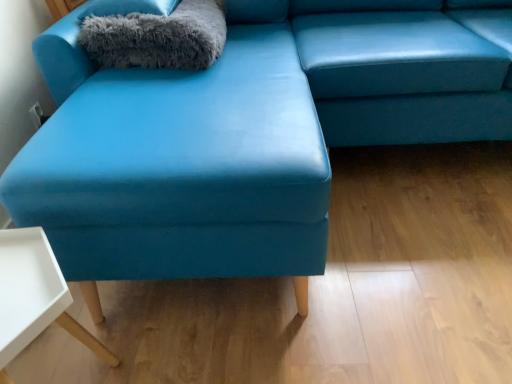
Question: From a real-world perspective, is gray fluffy pillow at upper left under white matte table at lower left?

Choices:
 (A) no
 (B) yes

Answer: (A)

Question: Is gray fluffy pillow at upper left facing towards white matte table at lower left?

Choices:
 (A) no
 (B) yes

Answer: (A)

Question: Is gray fluffy pillow at upper left wider than white matte table at lower left?

Choices:
 (A) yes
 (B) no

Answer: (A)

Question: From the image's perspective, is gray fluffy pillow at upper left located above white matte table at lower left?

Choices:
 (A) yes
 (B) no

Answer: (A)

Question: Is gray fluffy pillow at upper left positioned behind white matte table at lower left?

Choices:
 (A) no
 (B) yes

Answer: (B)

Question: Is matte blue cushion at center in front of or behind gray fluffy blanket at upper left in the image?

Choices:
 (A) behind
 (B) front

Answer: (B)

Question: Considering the positions of matte blue cushion at center and gray fluffy blanket at upper left in the image, is matte blue cushion at center bigger or smaller than gray fluffy blanket at upper left?

Choices:
 (A) big
 (B) small

Answer: (A)

Question: Considering the relative positions of matte blue cushion at center and gray fluffy blanket at upper left in the image provided, is matte blue cushion at center to the left or to the right of gray fluffy blanket at upper left?

Choices:
 (A) right
 (B) left

Answer: (A)

Question: From their relative heights in the image, would you say matte blue cushion at center is taller or shorter than gray fluffy blanket at upper left?

Choices:
 (A) short
 (B) tall

Answer: (B)

Question: From a real-world perspective, is gray fluffy blanket at upper left above or below matte blue cushion at center?

Choices:
 (A) below
 (B) above

Answer: (B)

Question: Is gray fluffy blanket at upper left spatially inside matte blue cushion at center, or outside of it?

Choices:
 (A) inside
 (B) outside

Answer: (B)

Question: Considering the relative positions of gray fluffy blanket at upper left and matte blue cushion at center in the image provided, is gray fluffy blanket at upper left to the left or to the right of matte blue cushion at center?

Choices:
 (A) right
 (B) left

Answer: (B)

Question: From the image's perspective, is gray fluffy blanket at upper left located above or below matte blue cushion at center?

Choices:
 (A) below
 (B) above

Answer: (B)

Question: Which is correct: gray fluffy blanket at upper left is inside gray fluffy pillow at upper left, or outside of it?

Choices:
 (A) inside
 (B) outside

Answer: (B)

Question: From a real-world perspective, is gray fluffy blanket at upper left physically located above or below gray fluffy pillow at upper left?

Choices:
 (A) above
 (B) below

Answer: (B)